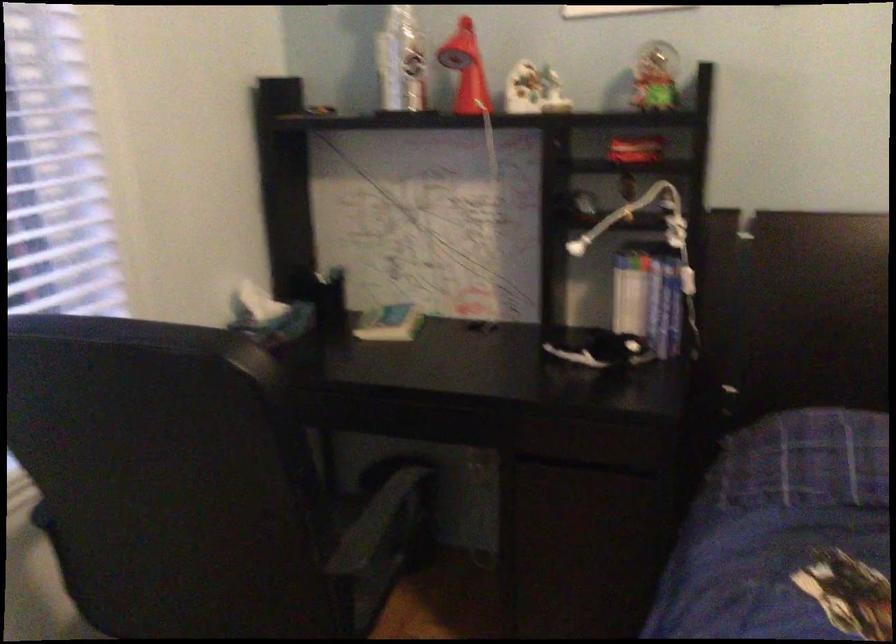
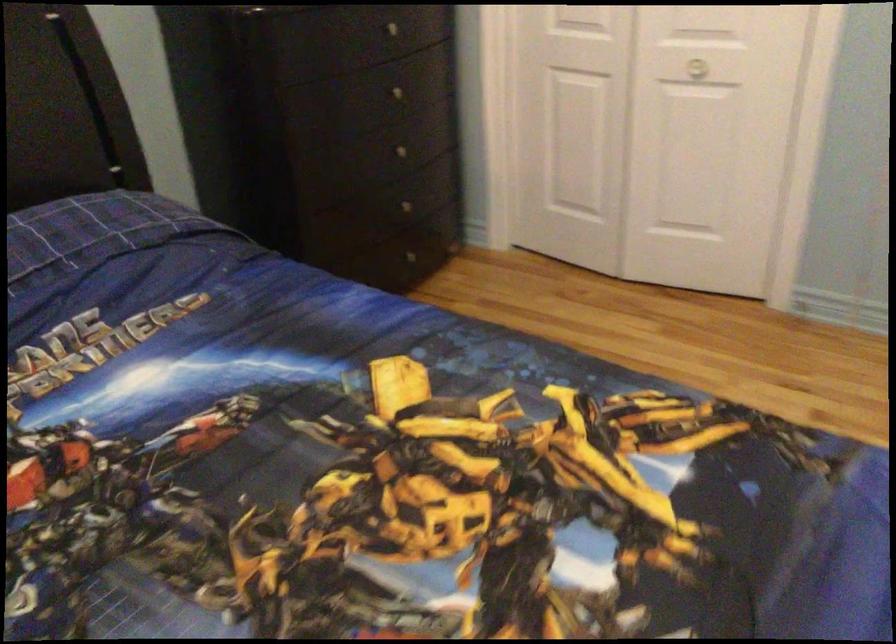
How did the camera likely rotate?

The camera's rotation is toward right-down.